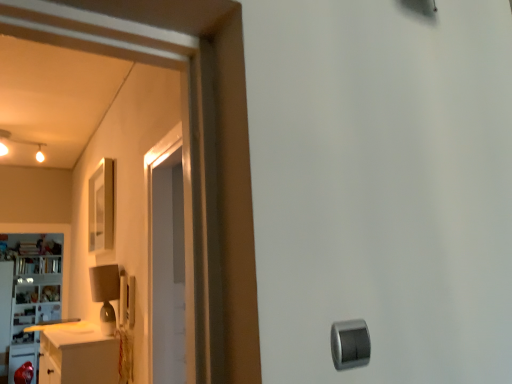
Question: Would you say silver metallic knob at lower right is to the left or to the right of white glossy cabinet at left in the picture?

Choices:
 (A) right
 (B) left

Answer: (A)

Question: Is silver metallic knob at lower right bigger or smaller than white glossy cabinet at left?

Choices:
 (A) small
 (B) big

Answer: (A)

Question: From a real-world perspective, is silver metallic knob at lower right above or below white glossy cabinet at left?

Choices:
 (A) above
 (B) below

Answer: (B)

Question: Is white glossy cabinet at left bigger or smaller than silver metallic knob at lower right?

Choices:
 (A) big
 (B) small

Answer: (A)

Question: From a real-world perspective, relative to silver metallic knob at lower right, is white glossy cabinet at left vertically above or below?

Choices:
 (A) above
 (B) below

Answer: (A)

Question: Looking at their shapes, would you say white glossy cabinet at left is wider or thinner than silver metallic knob at lower right?

Choices:
 (A) thin
 (B) wide

Answer: (B)

Question: Is point (51, 286) positioned closer to the camera than point (352, 329)?

Choices:
 (A) closer
 (B) farther

Answer: (B)